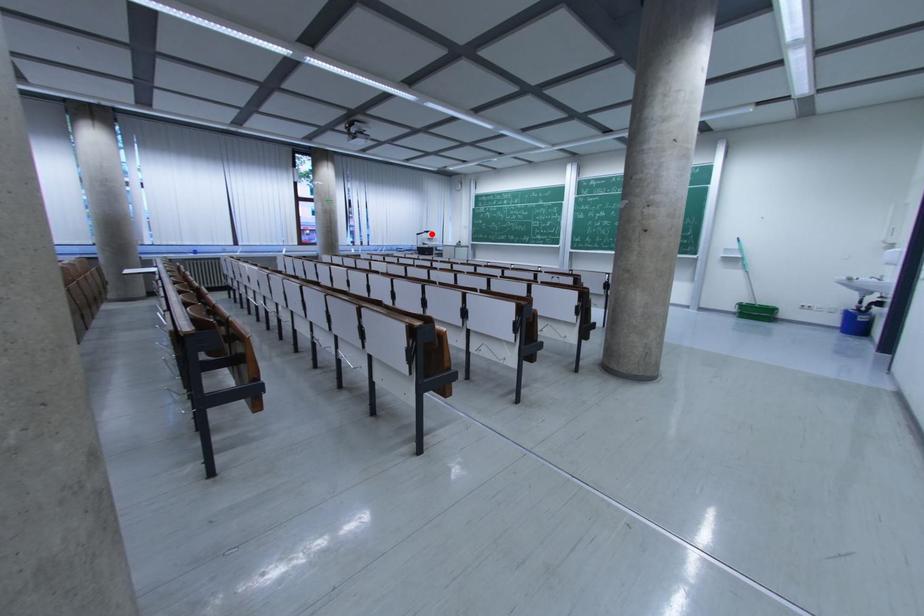
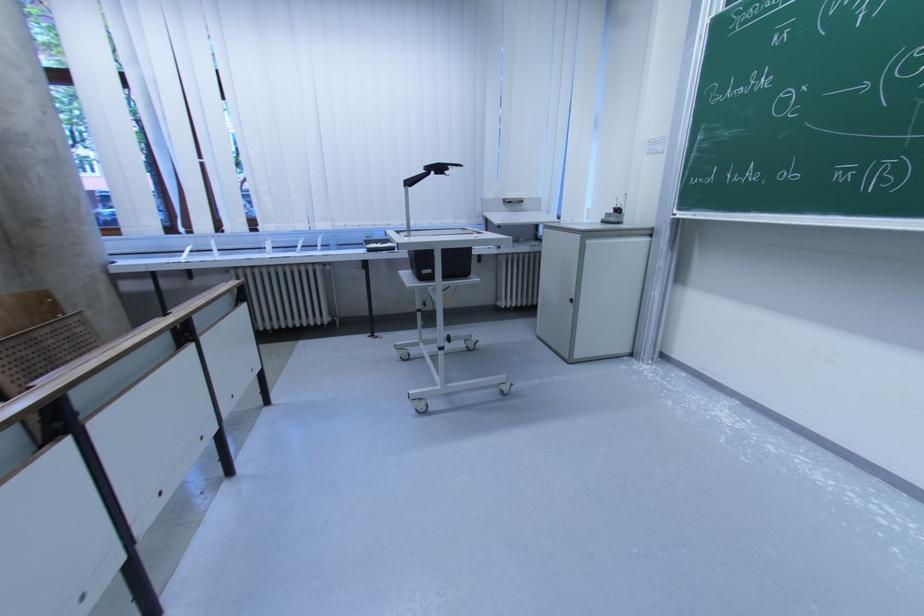
In the second image, find the point that corresponds to the highlighted location in the first image.

(444, 171)